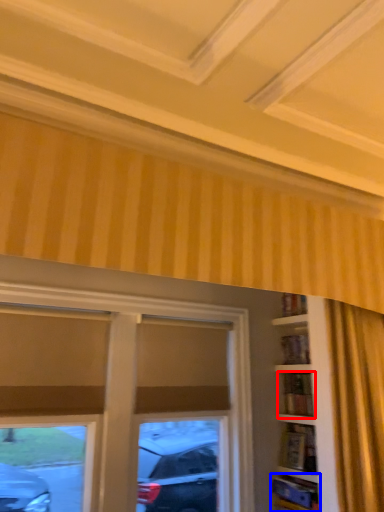
Question: Among these objects, which one is farthest to the camera, shelf (highlighted by a red box) or shelf (highlighted by a blue box)?

Choices:
 (A) shelf
 (B) shelf

Answer: (A)